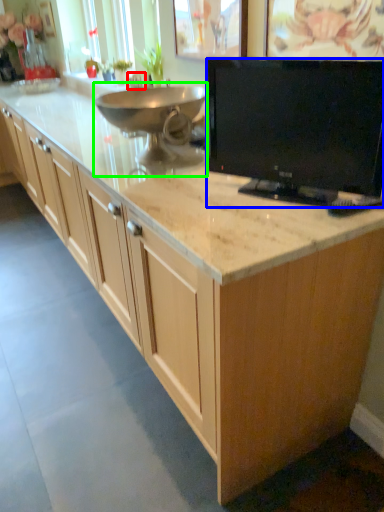
Question: Estimate the real-world distances between objects in this image. Which object is farther from faucet (highlighted by a red box), television (highlighted by a blue box) or appliance (highlighted by a green box)?

Choices:
 (A) television
 (B) appliance

Answer: (A)